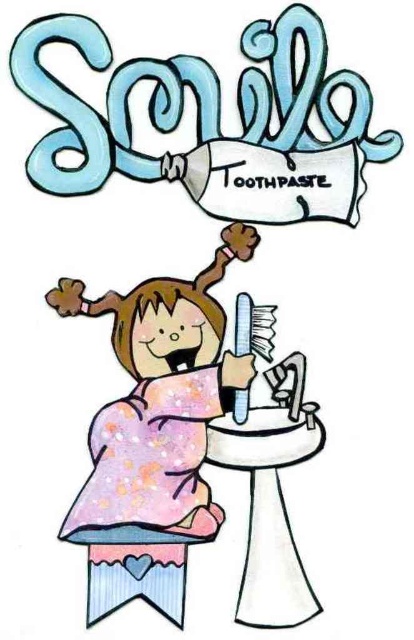
Question: Does white glossy sink at center appear under white plastic toothbrush at center?

Choices:
 (A) no
 (B) yes

Answer: (B)

Question: Can you confirm if pastel fabric stool at lower center is positioned below white plastic toothbrush at center?

Choices:
 (A) yes
 (B) no

Answer: (A)

Question: Which point is closer to the camera?

Choices:
 (A) blue paper toothpaste at upper center
 (B) white plastic toothbrush at center
 (C) pastel glitter dress at center
 (D) white glossy sink at center

Answer: (A)

Question: Is white glossy sink at center smaller than white plastic toothbrush at center?

Choices:
 (A) yes
 (B) no

Answer: (B)

Question: Which object appears farthest from the camera in this image?

Choices:
 (A) blue paper toothpaste at upper center
 (B) pastel glitter dress at center
 (C) white glossy sink at center

Answer: (C)

Question: Based on their relative distances, which object is nearer to the white plastic toothbrush at center?

Choices:
 (A) white glossy sink at center
 (B) pastel glitter dress at center

Answer: (A)